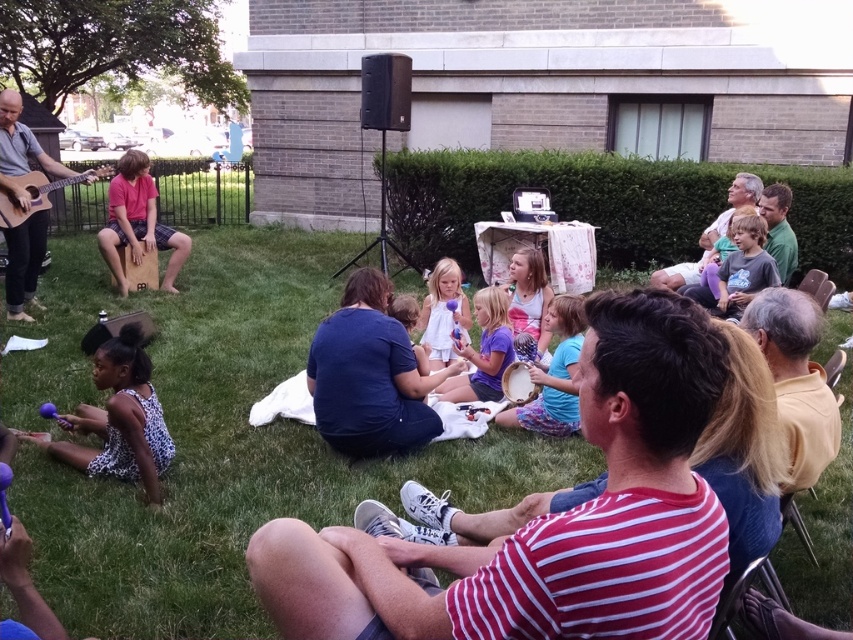
Question: Which point is farther to the camera?

Choices:
 (A) matte purple drum at center
 (B) matte white dress at center
 (C) striped cotton shirt at center
 (D) pink matte cajon at center

Answer: (D)

Question: Which point appears closest to the camera in this image?

Choices:
 (A) 537,285
 (B) 456,310

Answer: (B)

Question: In this image, where is spotted fabric dress at lower left located relative to purple matte drum at center?

Choices:
 (A) below
 (B) above

Answer: (A)

Question: Observing the image, what is the correct spatial positioning of purple matte drum at center in reference to dark gray shirt at center?

Choices:
 (A) below
 (B) above

Answer: (A)

Question: Which point is closer to the camera taking this photo?

Choices:
 (A) (494, 332)
 (B) (425, 305)
 (C) (743, 243)

Answer: (A)

Question: Does purple matte drum at center have a lesser width compared to acoustic wood guitar at left?

Choices:
 (A) yes
 (B) no

Answer: (A)